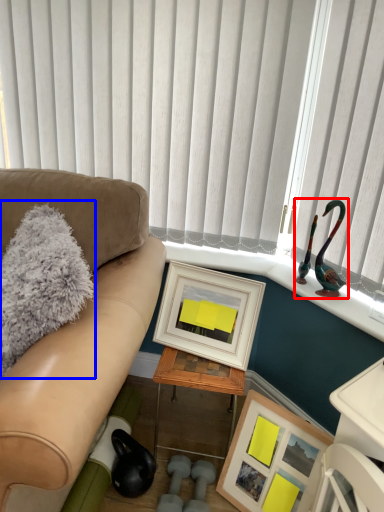
Question: Which object appears closest to the camera in this image, toy (highlighted by a red box) or pillow (highlighted by a blue box)?

Choices:
 (A) toy
 (B) pillow

Answer: (B)